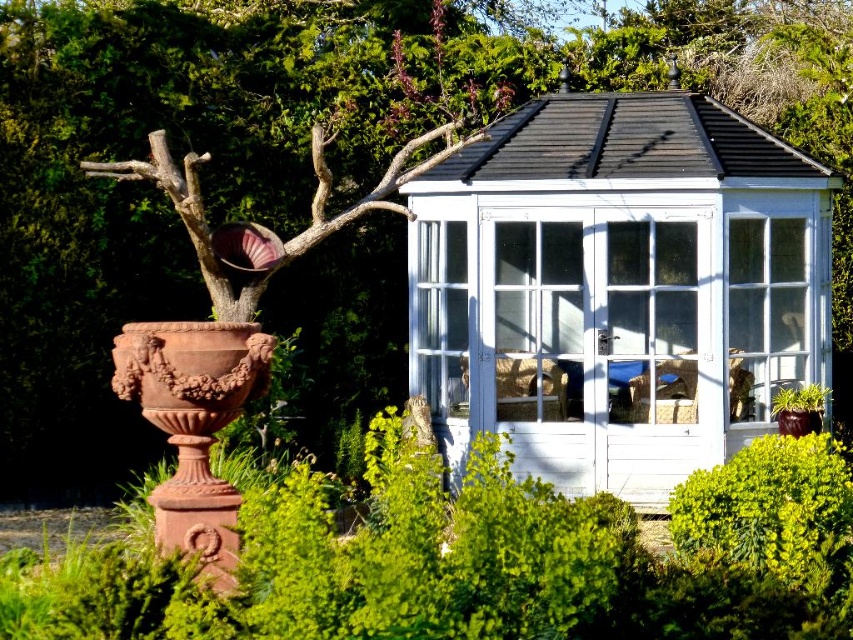
You are standing at point [618,285] in the garden. What structure can you see directly in front of you?

The white painted wood gazebo at center is located directly in front of you at point [618,285].

You are standing in the garden and see two points marked in the image. Which point is closer to you, point (x=764, y=157) or point (x=782, y=332)?

Point (x=764, y=157) is in front of point (x=782, y=332), so it is closer to you.

You are standing in a garden and want to take a photo of the white painted wood gazebo at center. If your camera has a maximum focus range of 15 meters, will you be able to capture a clear image of the gazebo?

The white painted wood gazebo at center is 15.33 meters away from the viewer. Since the camera can only focus up to 15 meters, it cannot capture a clear image of the gazebo as it is slightly beyond the maximum range.